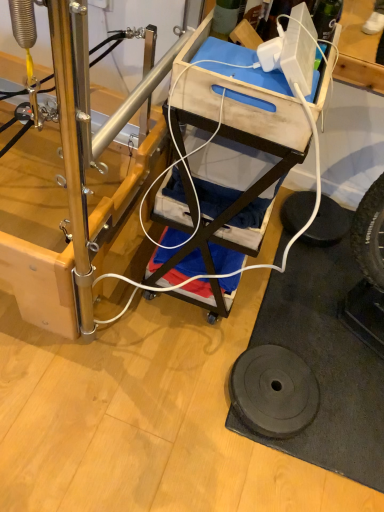
Image resolution: width=384 pixels, height=512 pixels. Identify the location of free space between black rubber tire at lower right and black rubber weight at lower right. (307, 293).